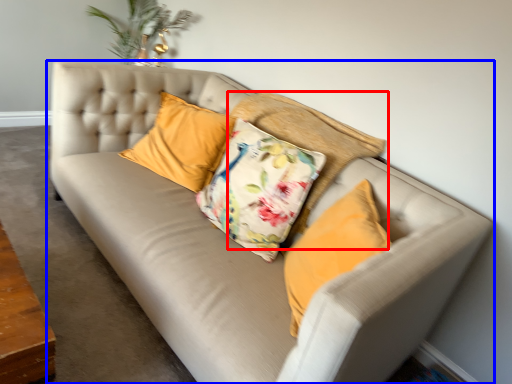
Question: Which object appears farthest to the camera in this image, pillow (highlighted by a red box) or studio couch (highlighted by a blue box)?

Choices:
 (A) pillow
 (B) studio couch

Answer: (A)